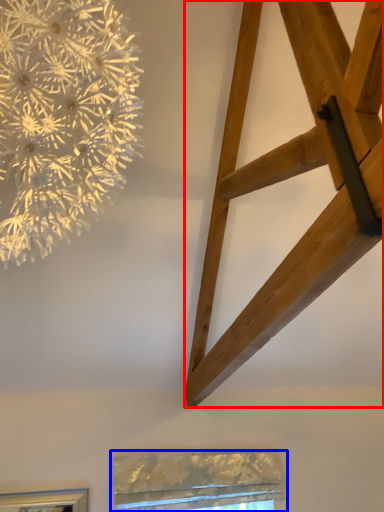
Question: Which point is closer to the camera, furniture (highlighted by a red box) or window (highlighted by a blue box)?

Choices:
 (A) furniture
 (B) window

Answer: (A)